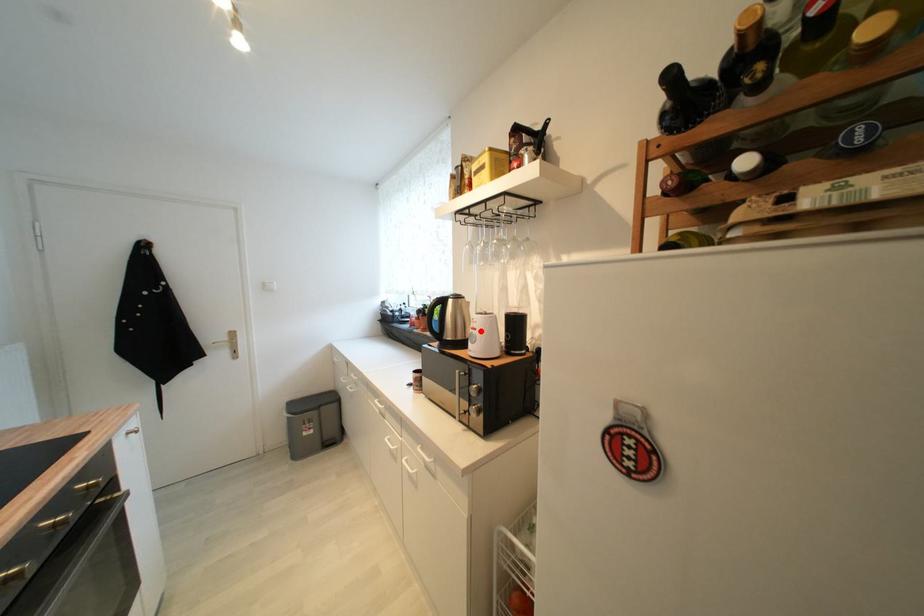
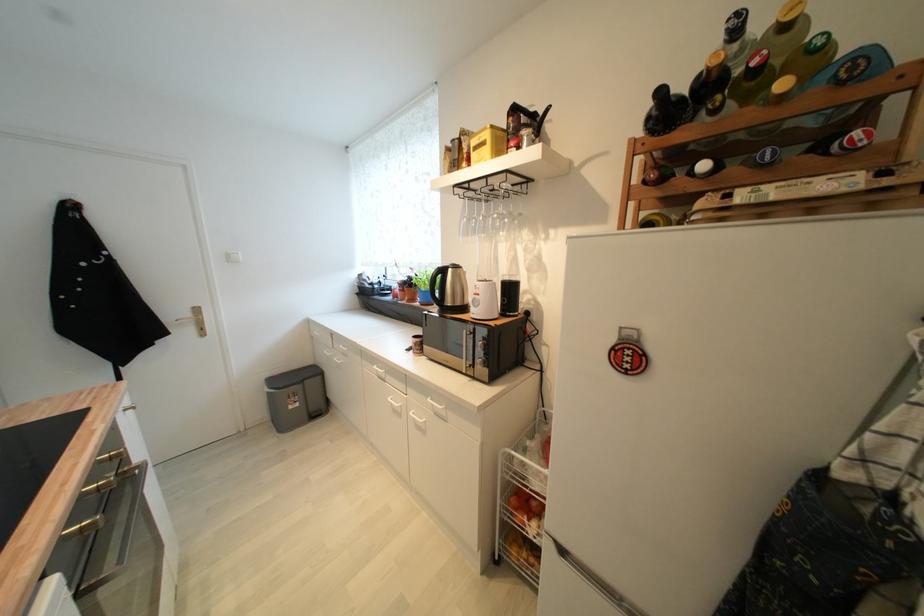
Where in the second image is the point corresponding to the highlighted location from the first image?

(483, 296)